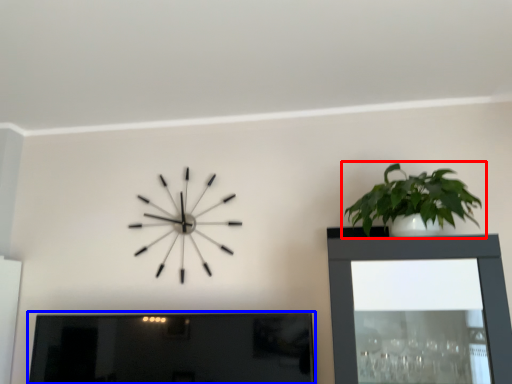
Question: Which point is closer to the camera, houseplant (highlighted by a red box) or picture frame (highlighted by a blue box)?

Choices:
 (A) houseplant
 (B) picture frame

Answer: (A)